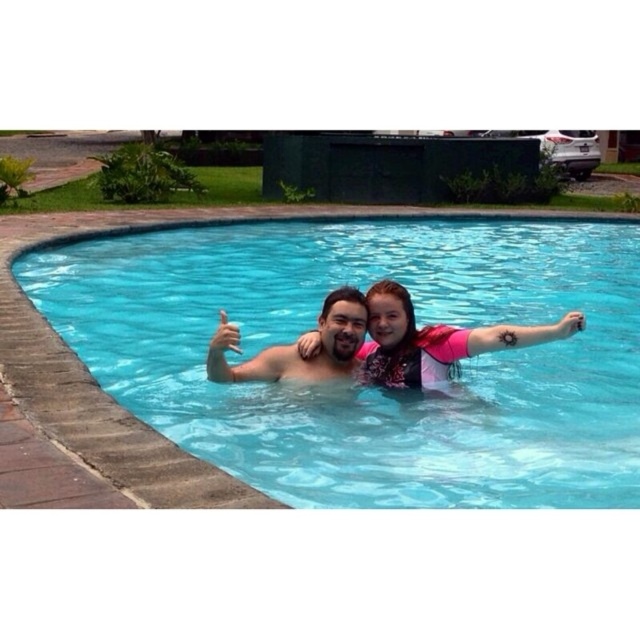
You are a photographer taking a picture of the clear blue water at center and the pink neoprene swimsuit at center. Which object will appear closer to the camera in the photo?

The clear blue water at center will appear closer to the camera because it is in front of the pink neoprene swimsuit at center.

From the picture: You are a swimmer who wants to jump into the pool. You see the clear blue water at center and the pink neoprene swimsuit at center. Which one is wider?

The clear blue water at center is wider than the pink neoprene swimsuit at center according to the description.